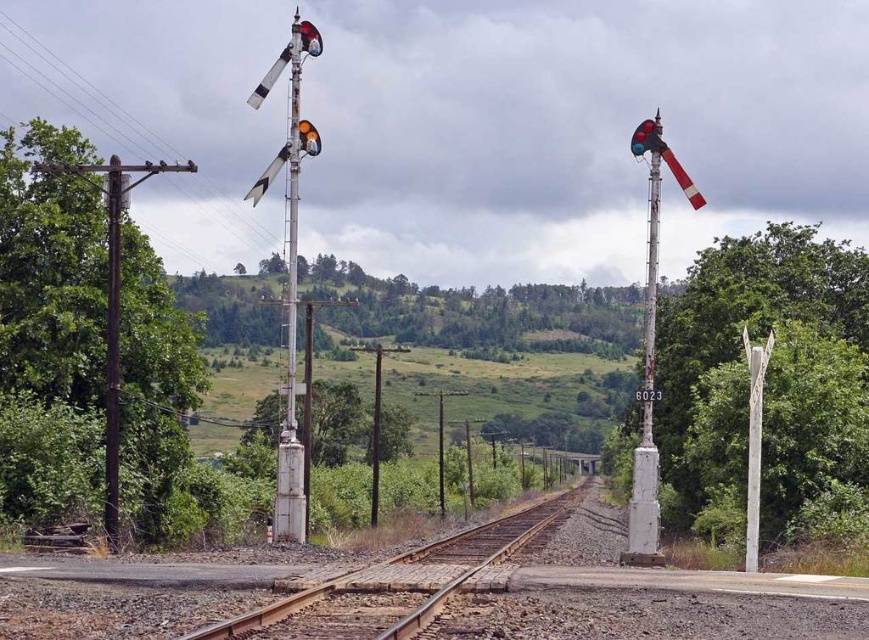
From the picture: You are a delivery driver approaching the railway crossing and need to know if your truck can pass through. The truck is 2 meters wide. Can you determine if the space between the white concrete pole at center and the smooth white pole at left is wide enough for your truck?

The white concrete pole at center might be wider than smooth white pole at left, so the space between them may not be wide enough for the truck. It is safer to check the actual width before proceeding.

You are a maintenance worker checking the railway crossing. You need to determine if the brown gravel train track at center is taller than the white painted metal pole at left. Based on the scene, what can you conclude?

The brown gravel train track at center is not as tall as the white painted metal pole at left, so the pole is taller than the track.